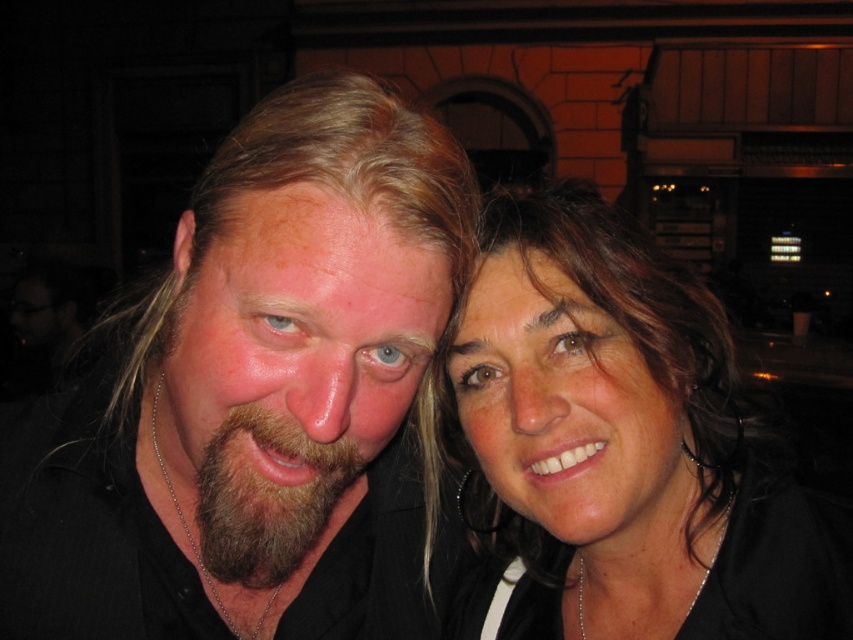
Looking at this image, between matte black hair at upper right and brownwoollybeard at center, which one has less height?

Standing shorter between the two is brownwoollybeard at center.

Can you confirm if matte black hair at upper right is wider than brownwoollybeard at center?

Indeed, matte black hair at upper right has a greater width compared to brownwoollybeard at center.

Locate an element on the screen. The height and width of the screenshot is (640, 853). matte black hair at upper right is located at coordinates (618, 444).

I want to click on matte black hair at upper right, so click(x=618, y=444).

Is point (270, 618) farther from camera compared to point (300, 451)?

Yes.

Where is `matte black hair at center`? Image resolution: width=853 pixels, height=640 pixels. matte black hair at center is located at coordinates (254, 397).

Is matte black hair at center shorter than matte black hair at upper right?

No, matte black hair at center is not shorter than matte black hair at upper right.

Which is behind, point (337, 436) or point (625, 412)?

The point (625, 412) is behind.

Does point (407, 630) lie behind point (579, 576)?

Yes, point (407, 630) is farther from viewer.

Locate an element on the screen. The height and width of the screenshot is (640, 853). matte black hair at center is located at coordinates (254, 397).